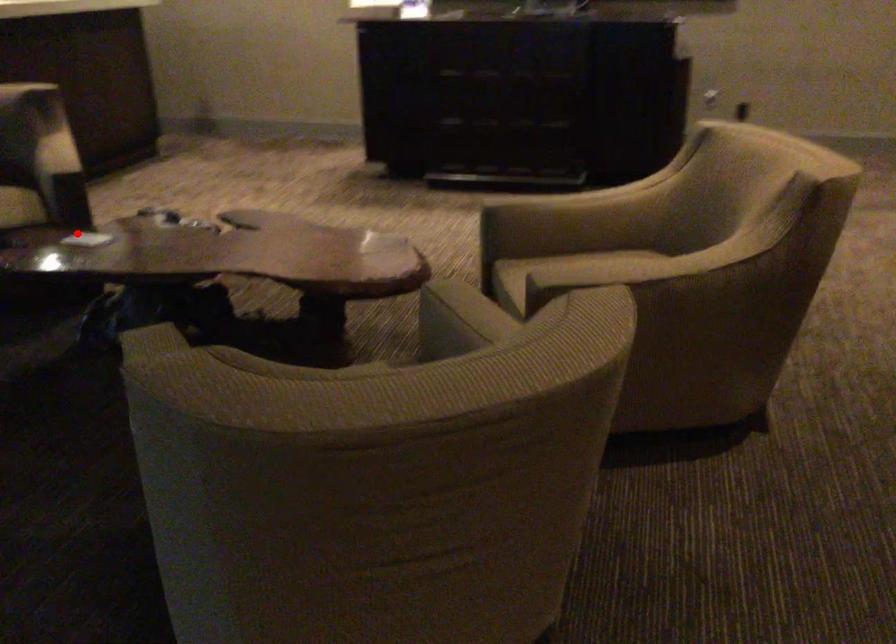
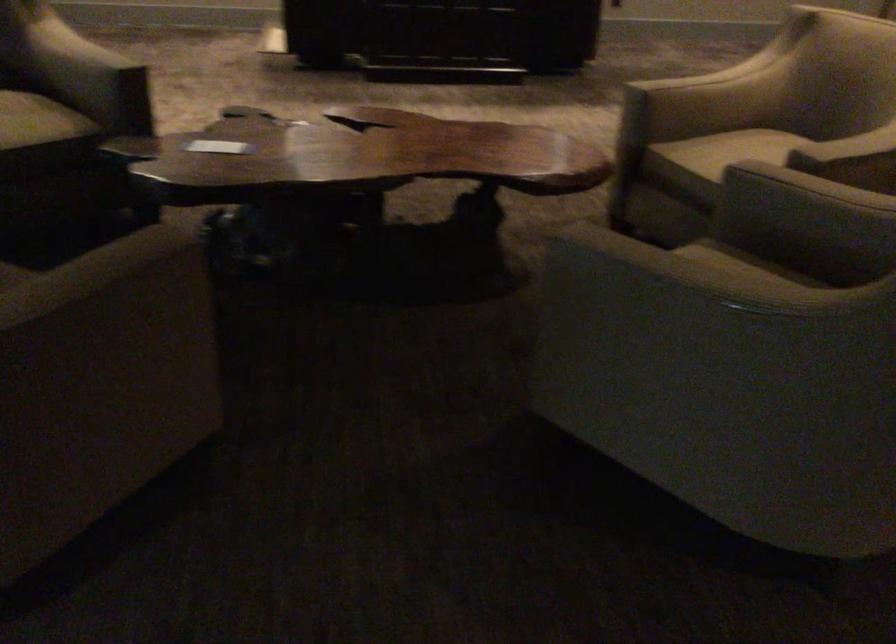
Where in the second image is the point corresponding to the highlighted location from the first image?

(218, 146)